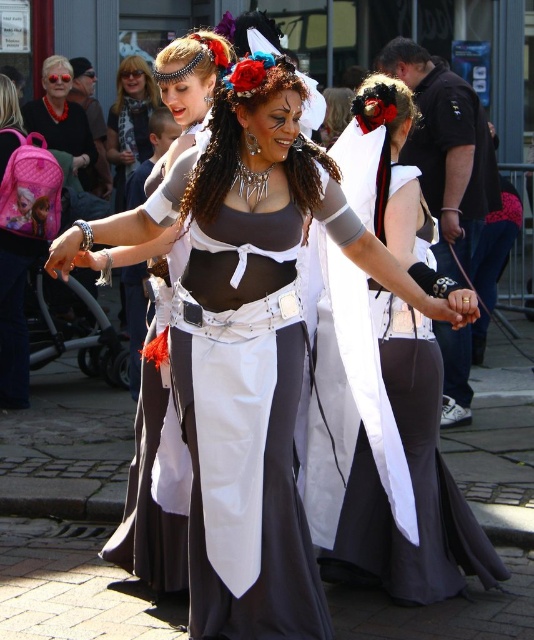
Is white satin dress at center below matte black hair at upper center?

Yes.

Is point (365, 433) less distant than point (120, 72)?

Yes, it is in front of point (120, 72).

Locate an element on the screen. The width and height of the screenshot is (534, 640). white satin dress at center is located at coordinates (412, 481).

Between point (451, 360) and point (247, 104), which one is positioned behind?

Positioned behind is point (451, 360).

Is white satin gloves at center above shiny silver necklace at center?

Indeed, white satin gloves at center is positioned over shiny silver necklace at center.

Find the location of a particular element. The width and height of the screenshot is (534, 640). white satin gloves at center is located at coordinates (446, 150).

Image resolution: width=534 pixels, height=640 pixels. Describe the element at coordinates (446, 150) in the screenshot. I see `white satin gloves at center` at that location.

Consider the image. Who is more forward, (411, 148) or (121, 112)?

Point (411, 148) is in front.

Between point (395, 51) and point (128, 109), which one is positioned in front?

Point (395, 51) is in front.

You are a GUI agent. You are given a task and a screenshot of the screen. Output one action in this format:
    pyautogui.click(x=<x>, y=<y>)
    Task: Click on the white satin gloves at center
    
    Given the screenshot: What is the action you would take?
    pyautogui.click(x=446, y=150)